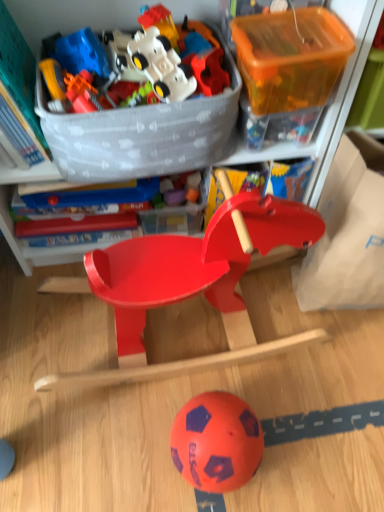
Where is `free space to the left of orange rubber ball at lower center`? The image size is (384, 512). free space to the left of orange rubber ball at lower center is located at coordinates (130, 445).